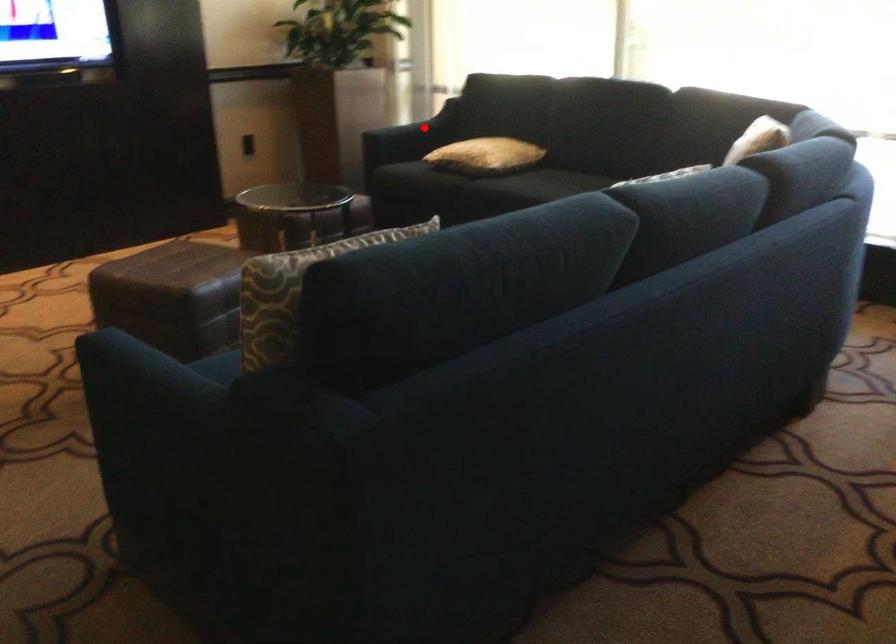
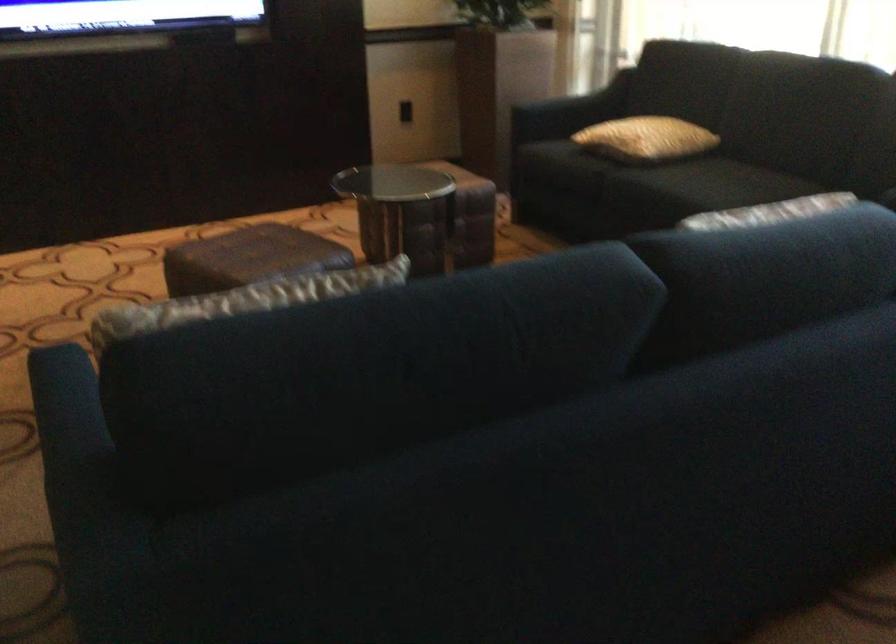
Where in the second image is the point corresponding to the highlighted location from the first image?

(586, 99)